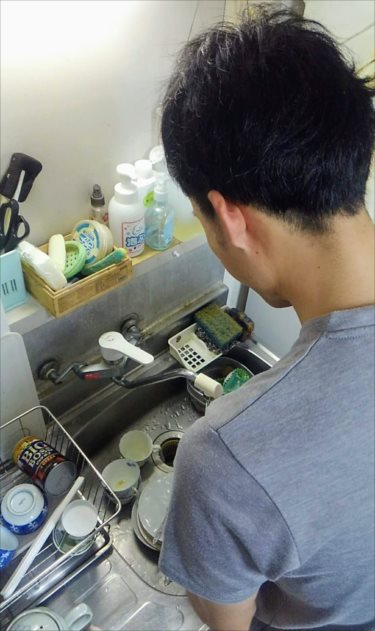
Locate an element on the screen. tea cups is located at coordinates (131, 493), (144, 452).